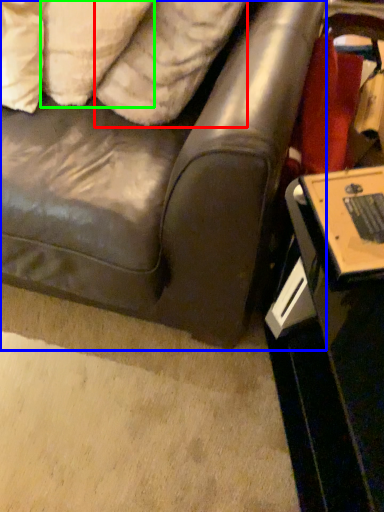
Question: Which is nearer to the pillow (highlighted by a red box)? studio couch (highlighted by a blue box) or pillow (highlighted by a green box).

Choices:
 (A) studio couch
 (B) pillow

Answer: (B)